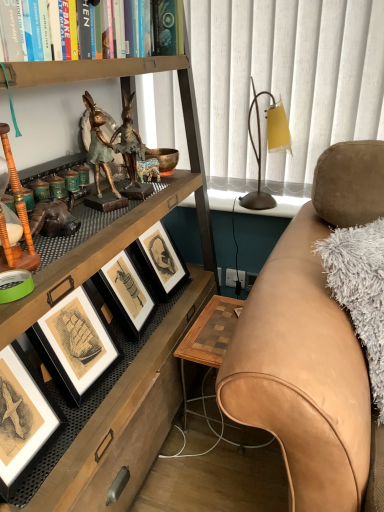
Question: Considering the relative sizes of matte black picture frame at lower left and wooden checkered table at lower right in the image provided, is matte black picture frame at lower left smaller than wooden checkered table at lower right?

Choices:
 (A) no
 (B) yes

Answer: (B)

Question: Considering the relative sizes of matte black picture frame at lower left and wooden checkered table at lower right in the image provided, is matte black picture frame at lower left thinner than wooden checkered table at lower right?

Choices:
 (A) no
 (B) yes

Answer: (B)

Question: From a real-world perspective, does matte black picture frame at lower left stand above wooden checkered table at lower right?

Choices:
 (A) yes
 (B) no

Answer: (A)

Question: Does matte black picture frame at lower left have a greater height compared to wooden checkered table at lower right?

Choices:
 (A) no
 (B) yes

Answer: (A)

Question: Is matte black picture frame at lower left outside wooden checkered table at lower right?

Choices:
 (A) yes
 (B) no

Answer: (A)

Question: In terms of height, does bronze statue at upper left look taller or shorter compared to tan leather couch at right?

Choices:
 (A) short
 (B) tall

Answer: (A)

Question: Considering their positions, is bronze statue at upper left located in front of or behind tan leather couch at right?

Choices:
 (A) front
 (B) behind

Answer: (B)

Question: From a real-world perspective, relative to tan leather couch at right, is bronze statue at upper left vertically above or below?

Choices:
 (A) above
 (B) below

Answer: (A)

Question: Considering the positions of bronze statue at upper left and tan leather couch at right in the image, is bronze statue at upper left bigger or smaller than tan leather couch at right?

Choices:
 (A) big
 (B) small

Answer: (B)

Question: Looking at the image, does matte black picture frame at lower left seem bigger or smaller compared to bronze statue at upper left?

Choices:
 (A) small
 (B) big

Answer: (B)

Question: In the image, is matte black picture frame at lower left positioned in front of or behind bronze statue at upper left?

Choices:
 (A) front
 (B) behind

Answer: (A)

Question: Is matte black picture frame at lower left taller or shorter than bronze statue at upper left?

Choices:
 (A) tall
 (B) short

Answer: (A)

Question: Is matte black picture frame at lower left inside the boundaries of bronze statue at upper left, or outside?

Choices:
 (A) outside
 (B) inside

Answer: (A)

Question: From their relative heights in the image, would you say tan leather couch at right is taller or shorter than hardcover book at upper left?

Choices:
 (A) tall
 (B) short

Answer: (A)

Question: Relative to hardcover book at upper left, is tan leather couch at right in front or behind?

Choices:
 (A) behind
 (B) front

Answer: (B)